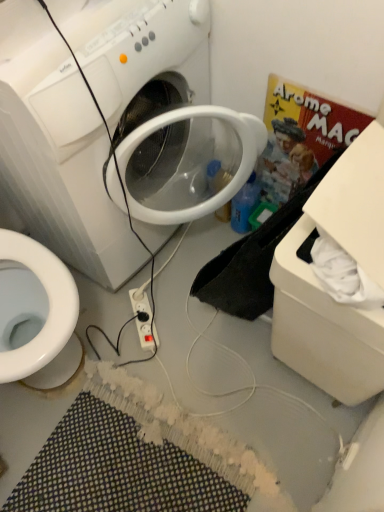
Where is `free space to the left of white plastic power outlet at center`? The width and height of the screenshot is (384, 512). free space to the left of white plastic power outlet at center is located at coordinates (99, 328).